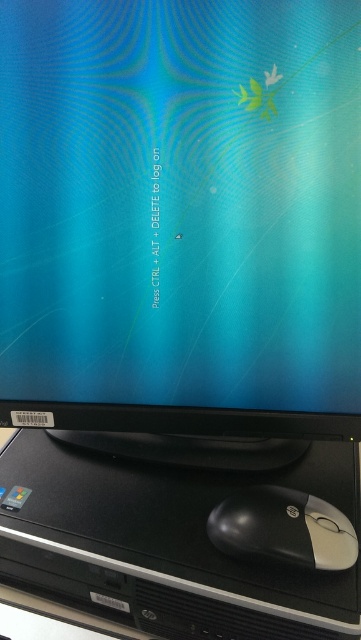
You are setting up a new monitor and need to place it precisely. According to the image, where should you position the new monitor relative to the black plastic computer at bottom?

The black plastic computer at bottom is located at point 2D coordinates of (167, 544). Therefore, the new monitor should be placed directly above this position to align with the existing setup.

You are trying to locate a specific point in the image. The point is labeled as point (167, 544). Based on the scene description, where would this point be located?

The point (167, 544) is on the black plastic computer at the bottom.